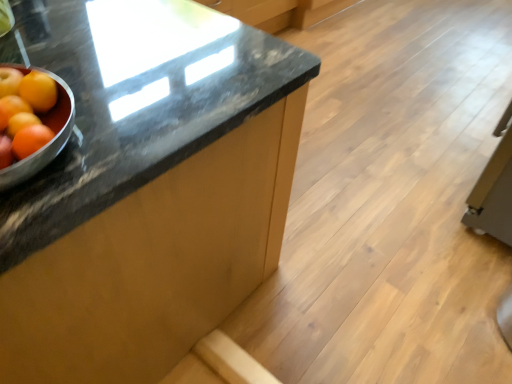
Find the location of a particular element. free space behind orange matte at left is located at coordinates tap(83, 56).